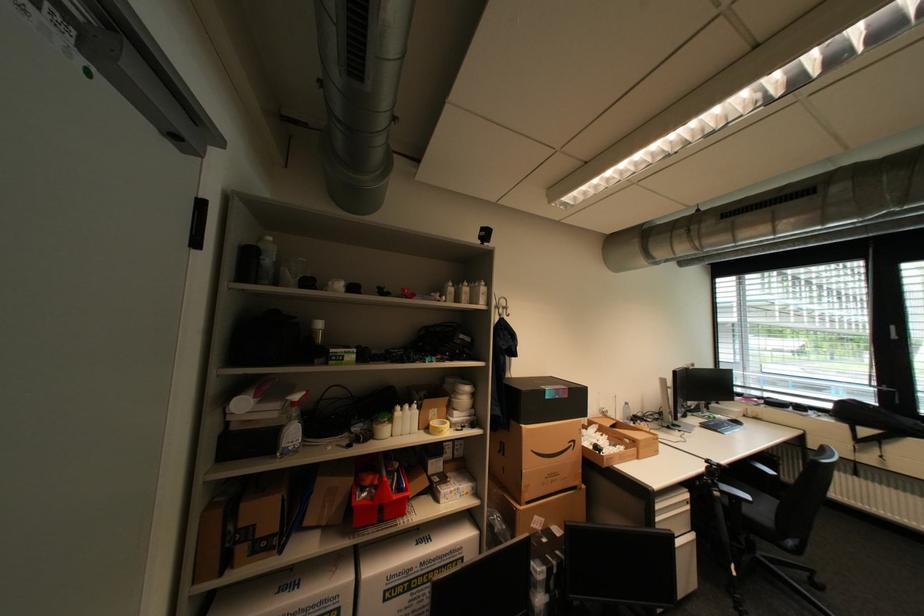
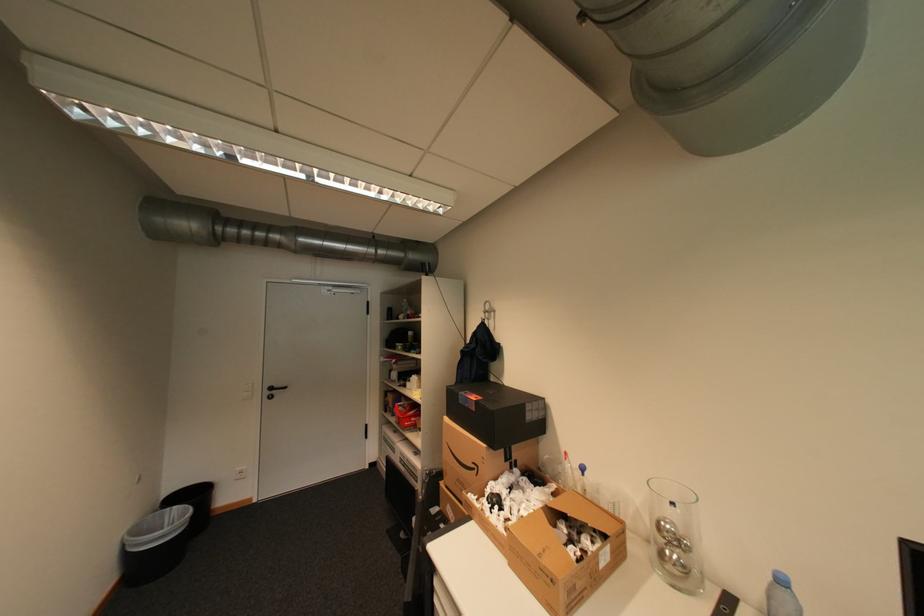
The point at (635, 405) is marked in the first image. Where is the corresponding point in the second image?

(791, 582)